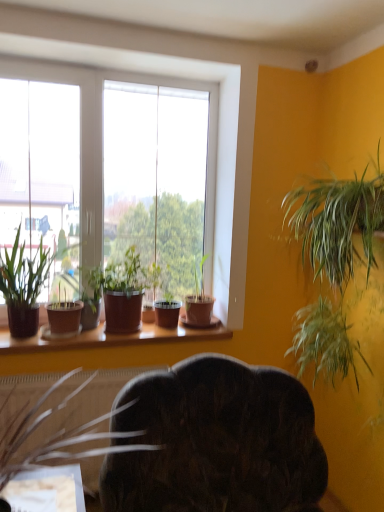
Question: Considering their positions, is dark wood swivel chair at center located in front of or behind brown matte pot at lower left, marked as the fifth houseplant in a right-to-left arrangement?

Choices:
 (A) behind
 (B) front

Answer: (B)

Question: Considering the positions of dark wood swivel chair at center and brown matte pot at lower left, positioned as the second houseplant in left-to-right order, in the image, is dark wood swivel chair at center bigger or smaller than brown matte pot at lower left, positioned as the second houseplant in left-to-right order,?

Choices:
 (A) small
 (B) big

Answer: (B)

Question: Estimate the real-world distances between objects in this image. Which object is farther from the green leafy plant at right, the first houseplant from the right?

Choices:
 (A) white plastic window at left
 (B) brown matte pot at lower left, positioned as the second houseplant in left-to-right order
 (C) dark wood swivel chair at center
 (D) matte brown pot at window, which is counted as the 5th houseplant, starting from the left
 (E) brown ceramic pots at lower center

Answer: (B)

Question: Estimate the real-world distances between objects in this image. Which object is closer to the green matte plant at center, the 4th houseplant in the left-to-right sequence?

Choices:
 (A) brown matte pot at lower left, positioned as the second houseplant in left-to-right order
 (B) white plastic window at left
 (C) matte brown pot at window, arranged as the 1th houseplant when viewed from the left
 (D) dark wood swivel chair at center
 (E) matte brown pot at window, which appears as the second houseplant when viewed from the right

Answer: (E)